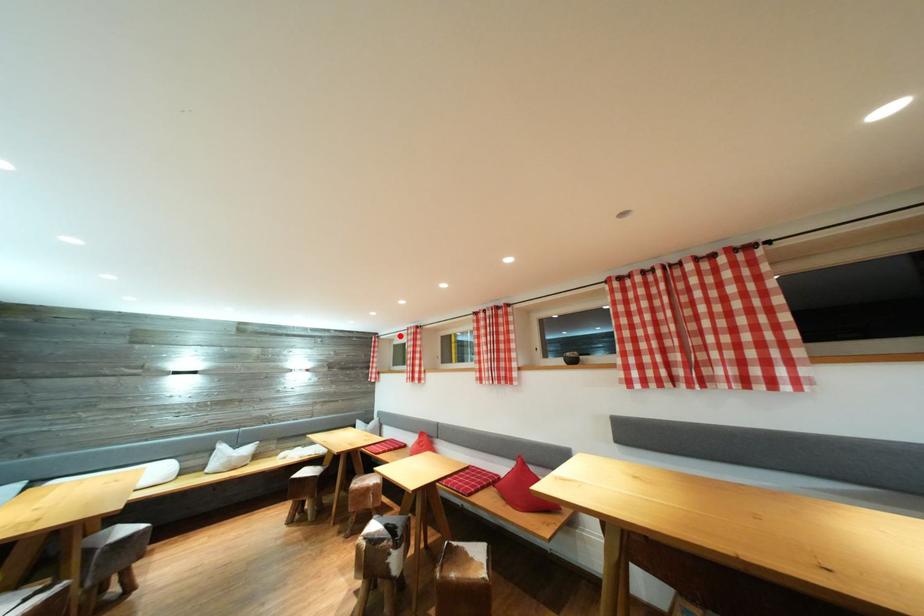
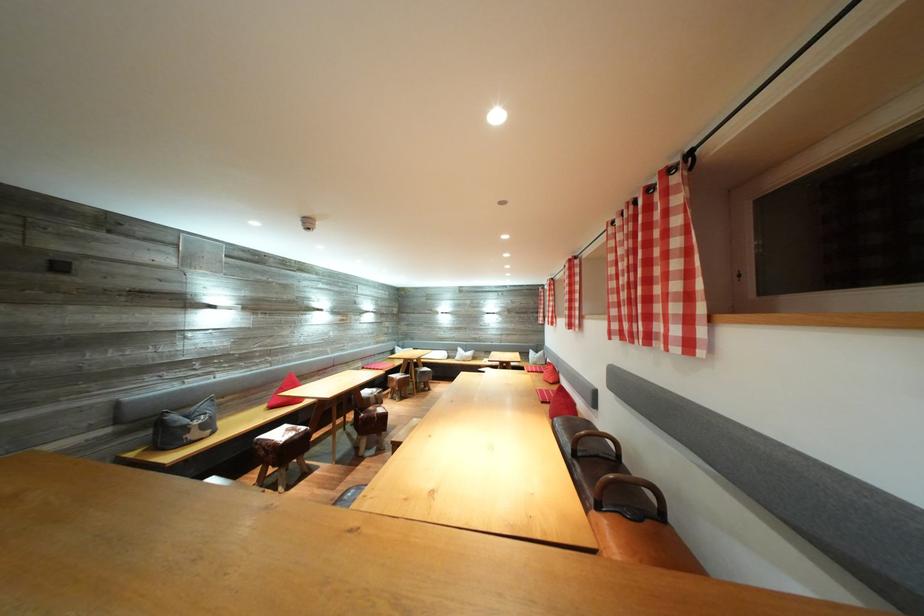
In the second image, find the point that corresponds to the highlighted location in the first image.

(553, 288)